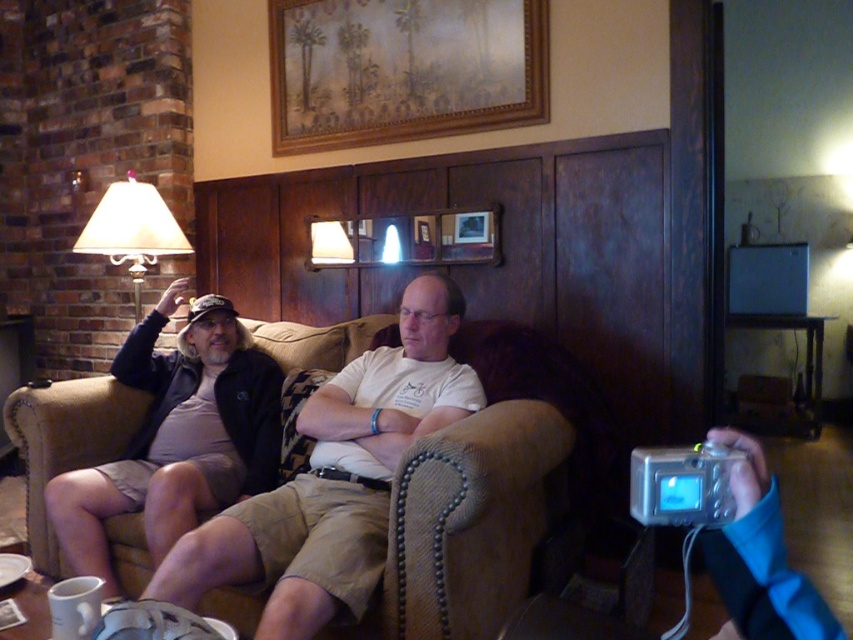
You are a guest in this living room and want to sit down. You see the suede couch at center and the matte beige lampshade at left. Which object should you approach if you want to sit closer to the side table with the lamp?

The suede couch at center is positioned on the right side of the matte beige lampshade at left, so approaching the suede couch at center would place you closer to the side table with the lamp.

In the living room scene, there is a matte black jacket at left and a matte beige lampshade at left. Which object is positioned more to the right from your perspective?

The matte black jacket at left is positioned to the right of the matte beige lampshade at left.

You are a guest in this living room and want to place a small table between the suede couch at center and the matte beige lampshade at left. Is the space between them suitable for placing the table?

The suede couch at center is in front of the matte beige lampshade at left, so there is space between them to place a small table.